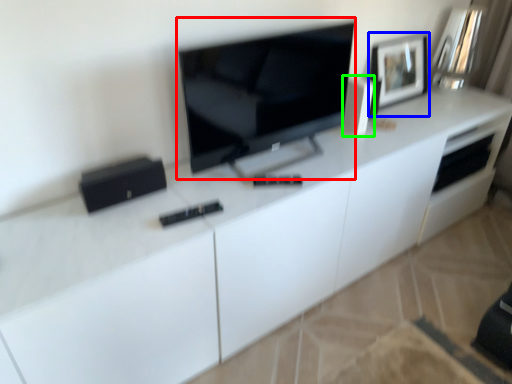
Question: Which object is positioned farthest from television (highlighted by a red box)? Select from picture frame (highlighted by a blue box) and appliance (highlighted by a green box).

Choices:
 (A) picture frame
 (B) appliance

Answer: (A)